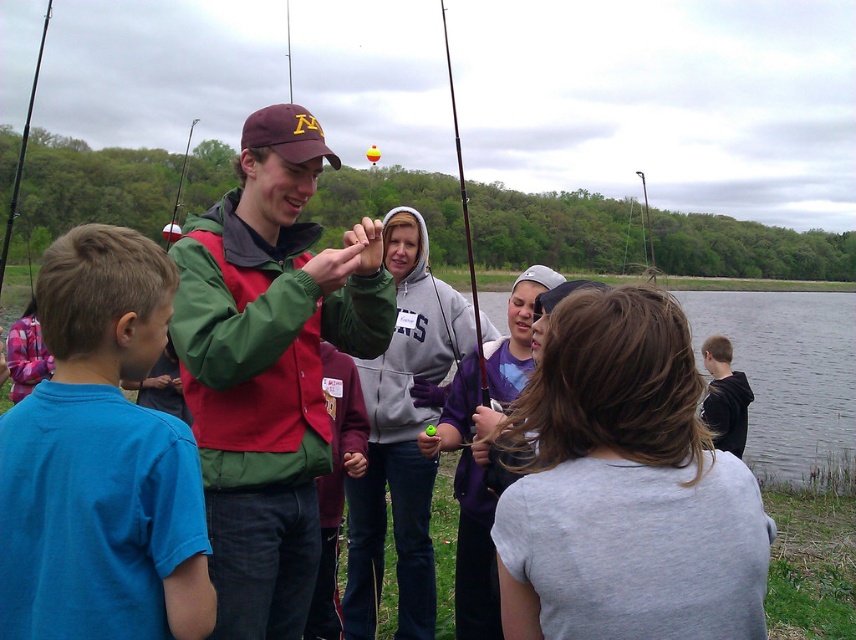
Question: Does smooth gray hoodie at center come in front of matte red jacket at center?

Choices:
 (A) yes
 (B) no

Answer: (A)

Question: From the image, what is the correct spatial relationship of dark gray hoodie at lower right in relation to black rod fishing pole at left?

Choices:
 (A) right
 (B) left

Answer: (A)

Question: Does green fabric jacket at center come in front of matte red jacket at center?

Choices:
 (A) no
 (B) yes

Answer: (B)

Question: Which point is closer to the camera?

Choices:
 (A) (648, 244)
 (B) (461, 573)

Answer: (B)

Question: Which point is closer to the camera taking this photo?

Choices:
 (A) (80, 470)
 (B) (161, 228)
 (C) (354, 401)

Answer: (A)

Question: Which point appears closest to the camera in this image?

Choices:
 (A) (307, 451)
 (B) (544, 266)
 (C) (643, 195)
 (D) (173, 202)

Answer: (A)